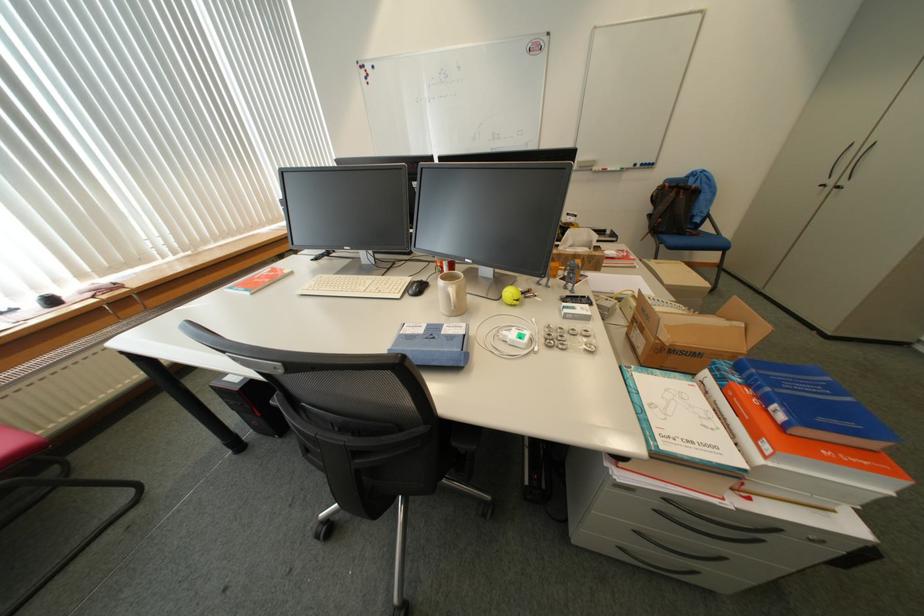
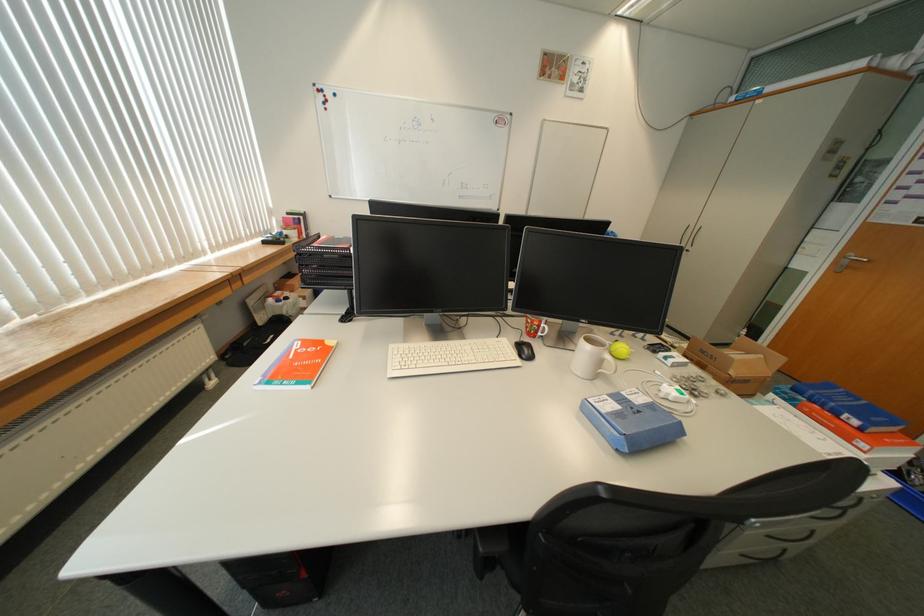
Question: Which direction would the cameraman need to move to produce the second image? Reply with the corresponding letter.

Choices:
 (A) Left
 (B) Right
 (C) Forward
 (D) Backward

Answer: (A)